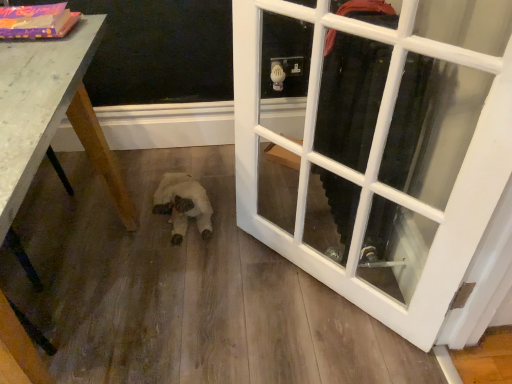
Identify the location of vacant area in front of white glass door at center. The height and width of the screenshot is (384, 512). (329, 336).